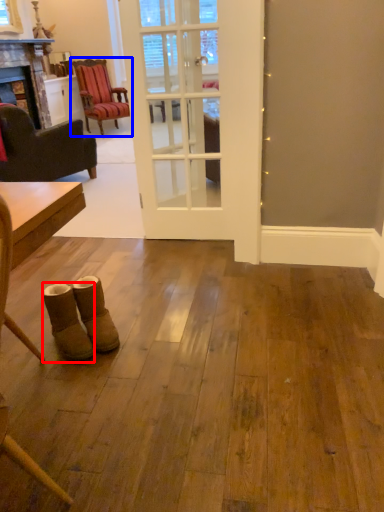
Question: Which object appears closest to the camera in this image, footwear (highlighted by a red box) or chair (highlighted by a blue box)?

Choices:
 (A) footwear
 (B) chair

Answer: (A)